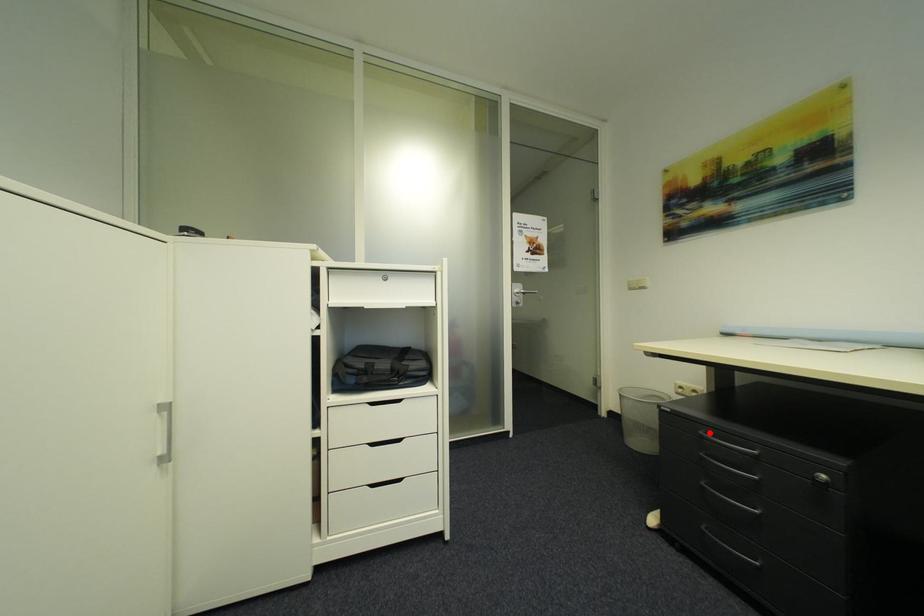
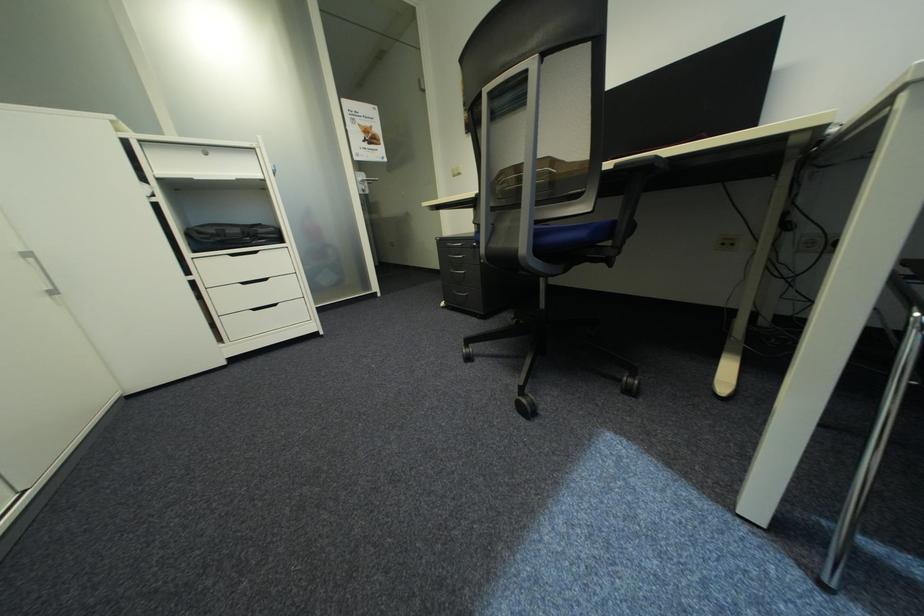
Question: I am providing you with two images of the same scene from different viewpoints. Image1 has a red point marked. In image2, the corresponding 3D location appears at what relative position? Reply with the corresponding letter.

Choices:
 (A) Closer
 (B) Farther

Answer: (A)